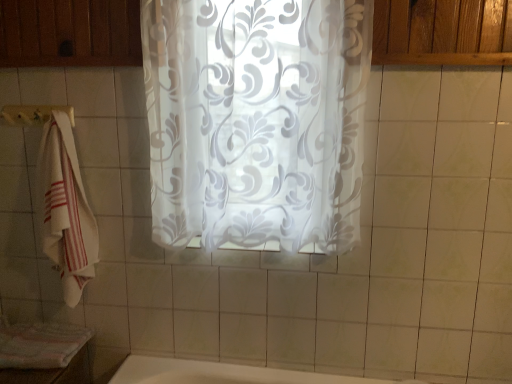
In order to face white fabric towel bar at left, should I rotate leftwards or rightwards?

A 27.464 degree turn to the left will do.

Describe the element at coordinates (32, 114) in the screenshot. I see `white fabric towel bar at left` at that location.

What do you see at coordinates (40, 345) in the screenshot? I see `striped cotton bath towel at lower left` at bounding box center [40, 345].

Locate an element on the screen. white fabric towel bar at left is located at coordinates (32, 114).

Looking at this image, does striped cotton bath towel at lower left turn towards white cotton towel at left?

No, striped cotton bath towel at lower left is not turned towards white cotton towel at left.

From the image's perspective, which one is positioned higher, striped cotton bath towel at lower left or white cotton towel at left?

white cotton towel at left is shown above in the image.

Between white cotton towel at left and transparent floral-patterned curtain at center, which one has larger width?

Wider between the two is white cotton towel at left.

From the picture: Is transparent floral-patterned curtain at center located within white cotton towel at left?

Actually, transparent floral-patterned curtain at center is outside white cotton towel at left.

Does point (87, 258) lie in front of point (221, 217)?

No, (87, 258) is further to viewer.

Is striped cotton bath towel at lower left not near transparent floral-patterned curtain at center?

No, striped cotton bath towel at lower left is not far from transparent floral-patterned curtain at center.

Does point (80, 340) come closer to viewer compared to point (361, 2)?

No, it is not.

Looking at this image, from the image's perspective, which one is positioned lower, striped cotton bath towel at lower left or transparent floral-patterned curtain at center?

From the image's view, striped cotton bath towel at lower left is below.

In terms of width, does striped cotton bath towel at lower left look wider or thinner when compared to transparent floral-patterned curtain at center?

striped cotton bath towel at lower left is wider than transparent floral-patterned curtain at center.

From the image's perspective, is transparent floral-patterned curtain at center above or below white cotton towel at left?

transparent floral-patterned curtain at center is situated higher than white cotton towel at left in the image.

Where is `curtain located above the white cotton towel at left (from a real-world perspective)`? curtain located above the white cotton towel at left (from a real-world perspective) is located at coordinates (256, 120).

Are transparent floral-patterned curtain at center and white cotton towel at left far apart?

No, transparent floral-patterned curtain at center is in close proximity to white cotton towel at left.

From a real-world perspective, relative to white cotton towel at left, is transparent floral-patterned curtain at center vertically above or below?

transparent floral-patterned curtain at center is above white cotton towel at left.

From a real-world perspective, which is physically above, white fabric towel bar at left or transparent floral-patterned curtain at center?

From a 3D spatial view, white fabric towel bar at left is above.

Considering the relative sizes of white fabric towel bar at left and transparent floral-patterned curtain at center in the image provided, is white fabric towel bar at left taller than transparent floral-patterned curtain at center?

In fact, white fabric towel bar at left may be shorter than transparent floral-patterned curtain at center.

From the image's perspective, who appears lower, white fabric towel bar at left or transparent floral-patterned curtain at center?

transparent floral-patterned curtain at center is shown below in the image.

Considering the positions of points (47, 116) and (214, 202), is point (47, 116) closer to camera compared to point (214, 202)?

That is False.

Is striped cotton bath towel at lower left in contact with white fabric towel bar at left?

No, striped cotton bath towel at lower left is not making contact with white fabric towel bar at left.

Does point (6, 335) appear closer or farther from the camera than point (6, 110)?

Clearly, point (6, 335) is more distant from the camera than point (6, 110).

Between striped cotton bath towel at lower left and white fabric towel bar at left, which one has larger width?

striped cotton bath towel at lower left is wider.

Consider the image. Which is more to the left, white fabric towel bar at left or striped cotton bath towel at lower left?

Positioned to the left is striped cotton bath towel at lower left.

How many degrees apart are the facing directions of white fabric towel bar at left and striped cotton bath towel at lower left?

white fabric towel bar at left and striped cotton bath towel at lower left are facing 4.68 degrees away from each other.

Between white fabric towel bar at left and striped cotton bath towel at lower left, which one is positioned behind?

white fabric towel bar at left.

At what (x,y) coordinates should I click in order to perform the action: click on towel that appears above the striped cotton bath towel at lower left (from a real-world perspective). Please return your answer as a coordinate pair (x, y). The height and width of the screenshot is (384, 512). Looking at the image, I should click on (65, 209).

The width and height of the screenshot is (512, 384). I want to click on towel that appears below the transparent floral-patterned curtain at center (from a real-world perspective), so pos(65,209).

Considering their positions, is white cotton towel at left positioned closer to white fabric towel bar at left than striped cotton bath towel at lower left?

white cotton towel at left is closer to white fabric towel bar at left.

Estimate the real-world distances between objects in this image. Which object is closer to striped cotton bath towel at lower left, white fabric towel bar at left or white cotton towel at left?

The object closer to striped cotton bath towel at lower left is white cotton towel at left.

Consider the image. Based on their spatial positions, is transparent floral-patterned curtain at center or white cotton towel at left closer to white fabric towel bar at left?

white cotton towel at left lies closer to white fabric towel bar at left than the other object.

Which object lies nearer to the anchor point white fabric towel bar at left, white cotton towel at left or transparent floral-patterned curtain at center?

Among the two, white cotton towel at left is located nearer to white fabric towel bar at left.

From the image, which object appears to be farther from white cotton towel at left, transparent floral-patterned curtain at center or striped cotton bath towel at lower left?

transparent floral-patterned curtain at center.

Which object lies nearer to the anchor point transparent floral-patterned curtain at center, white fabric towel bar at left or striped cotton bath towel at lower left?

white fabric towel bar at left lies closer to transparent floral-patterned curtain at center than the other object.

Based on their spatial positions, is transparent floral-patterned curtain at center or white fabric towel bar at left further from white cotton towel at left?

The object further to white cotton towel at left is transparent floral-patterned curtain at center.

Looking at the image, which one is located closer to white cotton towel at left, white fabric towel bar at left or transparent floral-patterned curtain at center?

Among the two, white fabric towel bar at left is located nearer to white cotton towel at left.

This screenshot has height=384, width=512. What are the coordinates of `towel located between striped cotton bath towel at lower left and transparent floral-patterned curtain at center in the left-right direction` in the screenshot? It's located at (65, 209).

Identify the location of towel between white fabric towel bar at left and transparent floral-patterned curtain at center. (65, 209).

Find the location of `towel bar between striped cotton bath towel at lower left and transparent floral-patterned curtain at center`. towel bar between striped cotton bath towel at lower left and transparent floral-patterned curtain at center is located at coordinates (32, 114).

The height and width of the screenshot is (384, 512). What are the coordinates of `towel between white fabric towel bar at left and striped cotton bath towel at lower left in the vertical direction` in the screenshot? It's located at (65, 209).